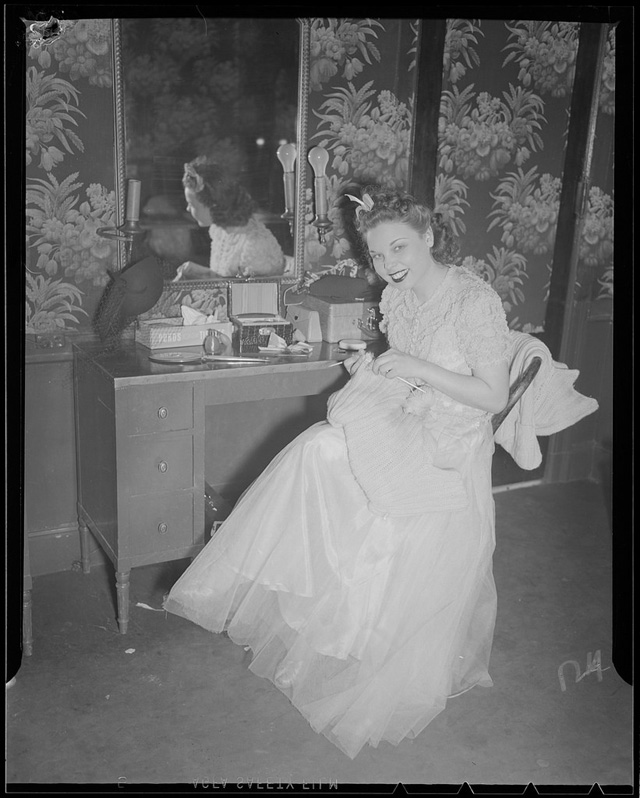
Locate an element on the screen. wall is located at coordinates (91, 184).